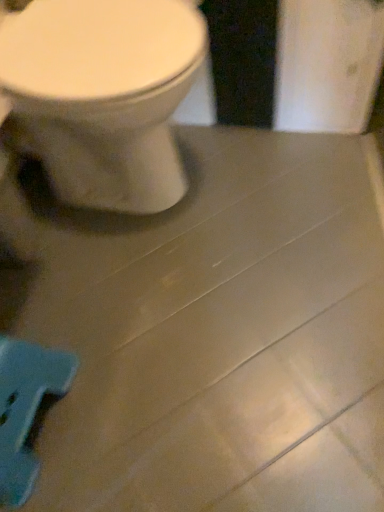
Question: From a real-world perspective, is white glossy toilet at upper left positioned above or below blue plastic toy at lower left?

Choices:
 (A) below
 (B) above

Answer: (B)

Question: From the image's perspective, is white glossy toilet at upper left located above or below blue plastic toy at lower left?

Choices:
 (A) above
 (B) below

Answer: (A)

Question: Based on their positions, is white glossy toilet at upper left located to the left or right of blue plastic toy at lower left?

Choices:
 (A) left
 (B) right

Answer: (B)

Question: From the image's perspective, is blue plastic toy at lower left positioned above or below white glossy toilet at upper left?

Choices:
 (A) above
 (B) below

Answer: (B)

Question: Is point click(8, 458) positioned closer to the camera than point click(122, 66)?

Choices:
 (A) farther
 (B) closer

Answer: (A)

Question: From their relative heights in the image, would you say blue plastic toy at lower left is taller or shorter than white glossy toilet at upper left?

Choices:
 (A) short
 (B) tall

Answer: (A)

Question: Considering the relative positions of blue plastic toy at lower left and white glossy toilet at upper left in the image provided, is blue plastic toy at lower left to the left or to the right of white glossy toilet at upper left?

Choices:
 (A) right
 (B) left

Answer: (B)